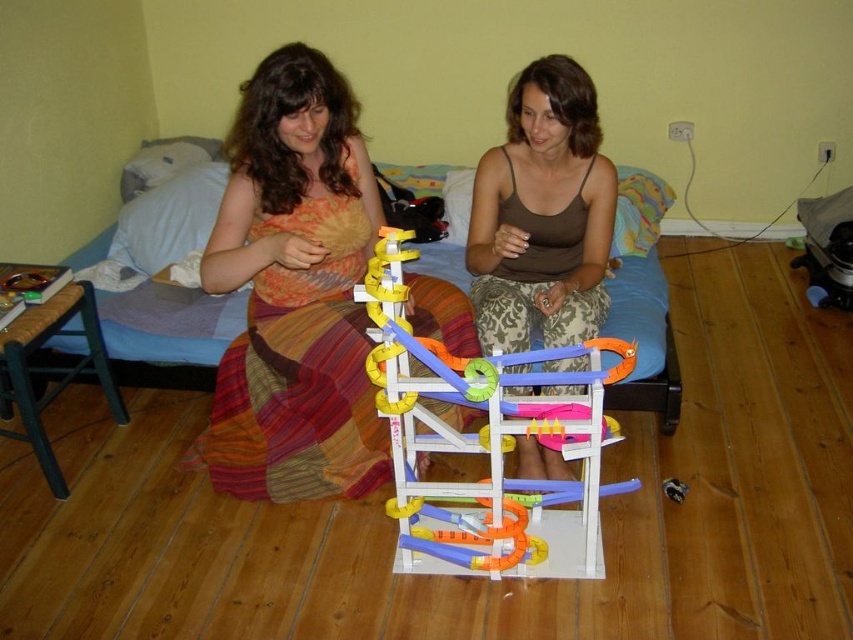
Does multicolored fabric skirt at center have a lesser width compared to multicolored plastic race track at center?

Indeed, multicolored fabric skirt at center has a lesser width compared to multicolored plastic race track at center.

Is multicolored fabric skirt at center bigger than multicolored plastic race track at center?

Yes, multicolored fabric skirt at center is bigger than multicolored plastic race track at center.

Which is in front, point (305, 106) or point (471, 499)?

Point (305, 106) is in front.

The image size is (853, 640). In order to click on multicolored fabric skirt at center in this screenshot , I will do `click(294, 291)`.

Is point (519, 513) in front of point (531, 108)?

Yes, point (519, 513) is closer to viewer.

You are a GUI agent. You are given a task and a screenshot of the screen. Output one action in this format:
    pyautogui.click(x=<x>, y=<y>)
    Task: Click on the multicolored plastic race track at center
    This screenshot has height=640, width=853.
    Given the screenshot: What is the action you would take?
    pyautogui.click(x=486, y=445)

Who is positioned more to the left, blue fabric bed at center or brown woven stool at left?

From the viewer's perspective, brown woven stool at left appears more on the left side.

Between point (164, 384) and point (21, 317), which one is positioned in front?

Positioned in front is point (21, 317).

Locate an element on the screen. The width and height of the screenshot is (853, 640). blue fabric bed at center is located at coordinates (167, 333).